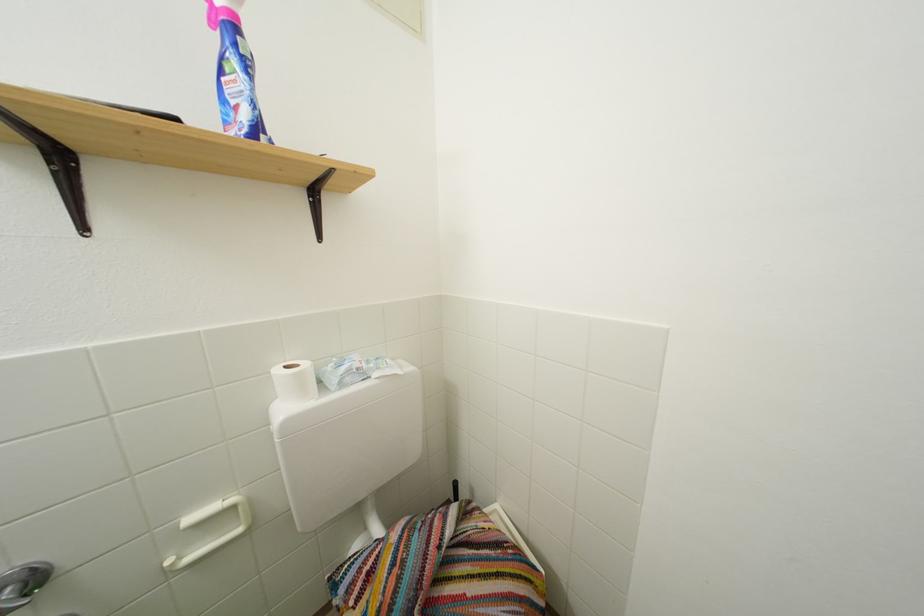
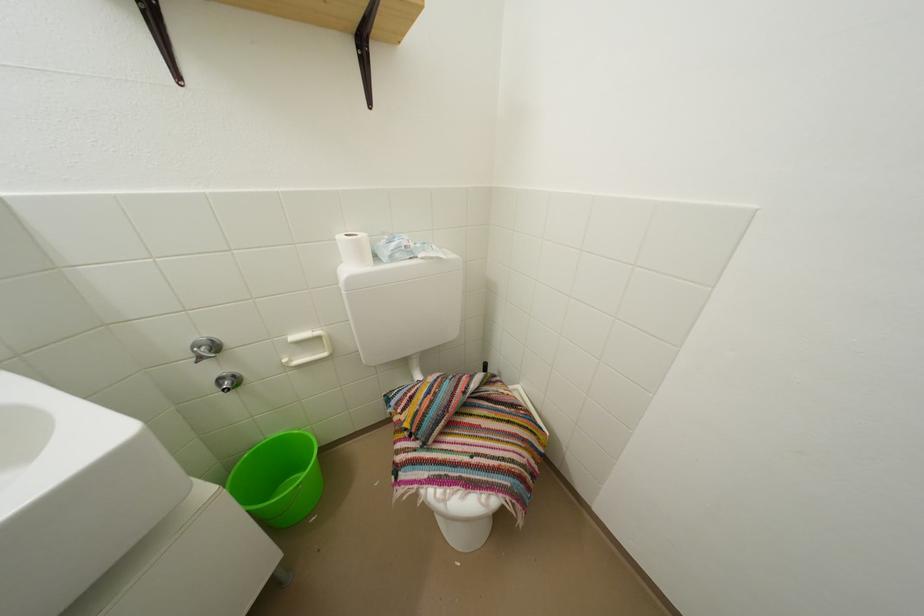
Question: The images are taken continuously from a first-person perspective. In which direction is your viewpoint rotating?

Choices:
 (A) Left
 (B) Right
 (C) Up
 (D) Down

Answer: (D)